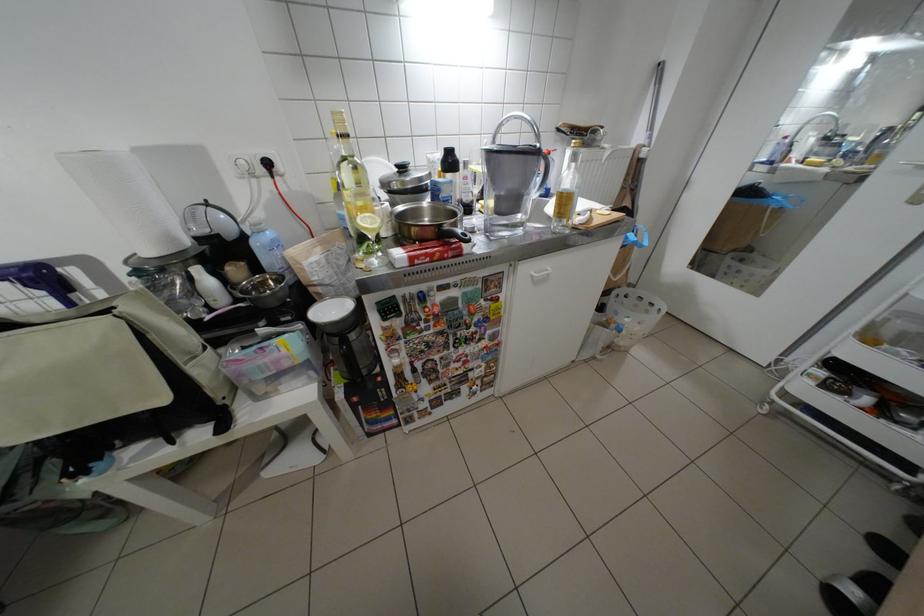
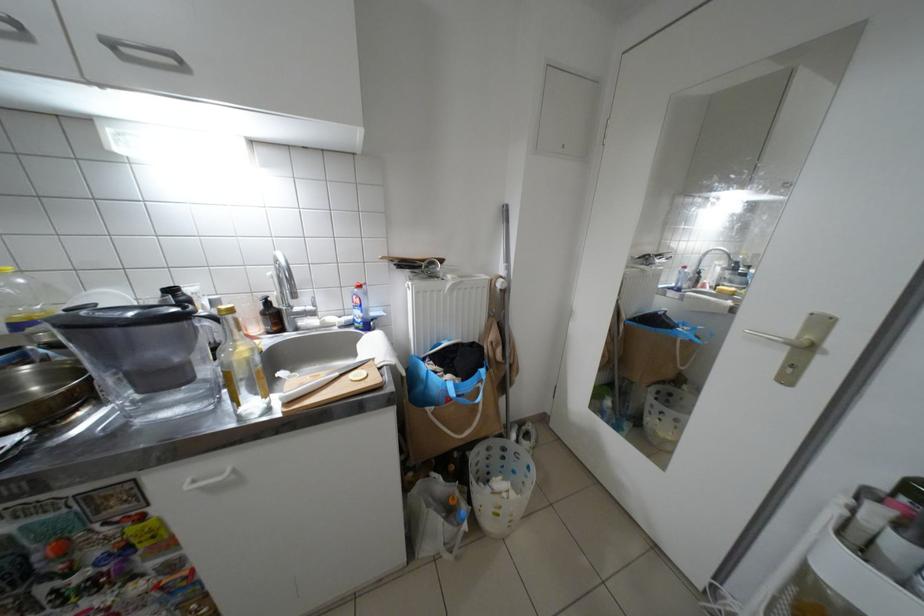
Where in the second image is the point corresponding to [638,176] from the first image?

(502, 304)